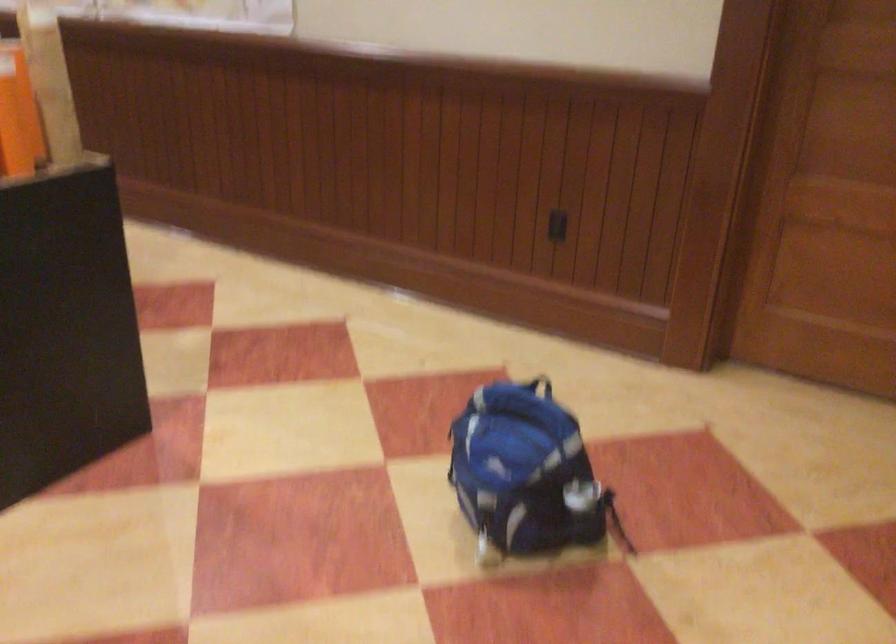
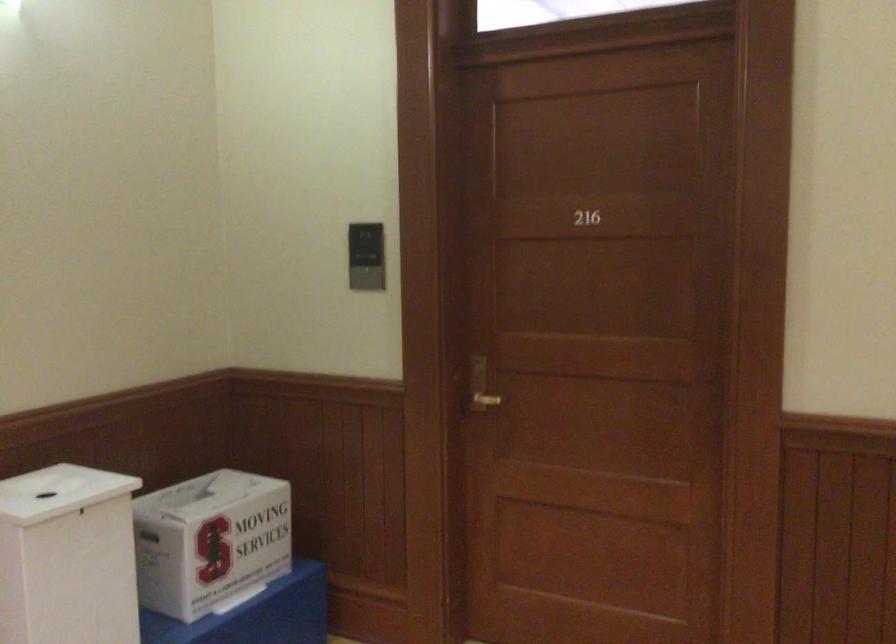
Question: The camera is either moving clockwise (left) or counter-clockwise (right) around the object. The first image is from the beginning of the video and the second image is from the end. Is the camera moving left or right when shooting the video?

Choices:
 (A) Left
 (B) Right

Answer: (A)